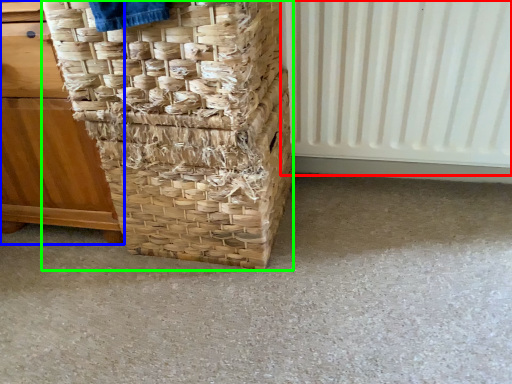
Question: Which object is the closest to the radiator (highlighted by a red box)? Choose among these: furniture (highlighted by a blue box) or basket (highlighted by a green box).

Choices:
 (A) furniture
 (B) basket

Answer: (B)